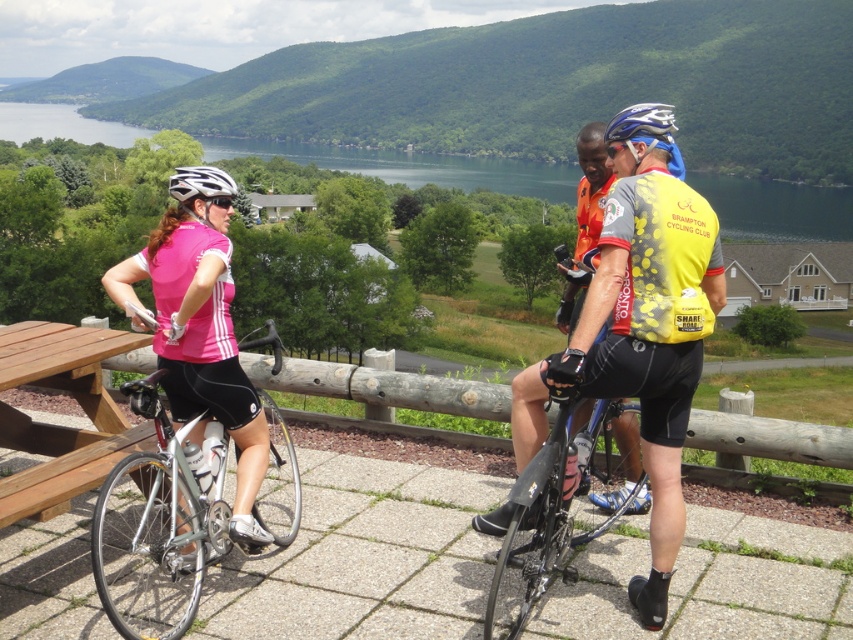
How much distance is there between blue matte bicycle helmet at center and white matte bicycle helmet at left?

blue matte bicycle helmet at center is 7.65 meters away from white matte bicycle helmet at left.

Is blue matte bicycle helmet at center to the left of white matte bicycle helmet at left from the viewer's perspective?

In fact, blue matte bicycle helmet at center is to the right of white matte bicycle helmet at left.

The height and width of the screenshot is (640, 853). Describe the element at coordinates (642, 124) in the screenshot. I see `blue matte bicycle helmet at center` at that location.

You are a GUI agent. You are given a task and a screenshot of the screen. Output one action in this format:
    pyautogui.click(x=<x>, y=<y>)
    Task: Click on the blue matte bicycle helmet at center
    The height and width of the screenshot is (640, 853).
    Given the screenshot: What is the action you would take?
    pyautogui.click(x=642, y=124)

Measure the distance between silver metallic bicycle at left and camera.

silver metallic bicycle at left is 4.12 meters away from camera.

Between point (184, 588) and point (663, 106), which one is positioned in front?

Positioned in front is point (663, 106).

Is point (109, 477) less distant than point (668, 113)?

Yes.

Identify the location of silver metallic bicycle at left. (157, 525).

Is wooden picnic table at lower left shorter than white matte bicycle helmet at left?

Yes, wooden picnic table at lower left is shorter than white matte bicycle helmet at left.

Who is shorter, wooden picnic table at lower left or white matte bicycle helmet at left?

Standing shorter between the two is wooden picnic table at lower left.

Which is behind, point (15, 448) or point (181, 182)?

The point (15, 448) is more distant.

Locate an element on the screen. The height and width of the screenshot is (640, 853). wooden picnic table at lower left is located at coordinates (59, 426).